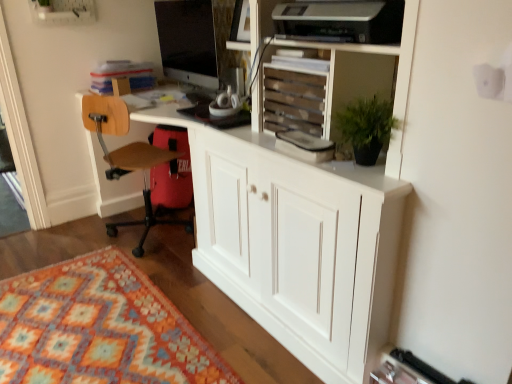
You are a GUI agent. You are given a task and a screenshot of the screen. Output one action in this format:
    pyautogui.click(x=<x>, y=<y>)
    Task: Click on the free space above multicolored woven rug at lower left (from a real-world perspective)
    The image size is (512, 384).
    Given the screenshot: What is the action you would take?
    pyautogui.click(x=98, y=320)